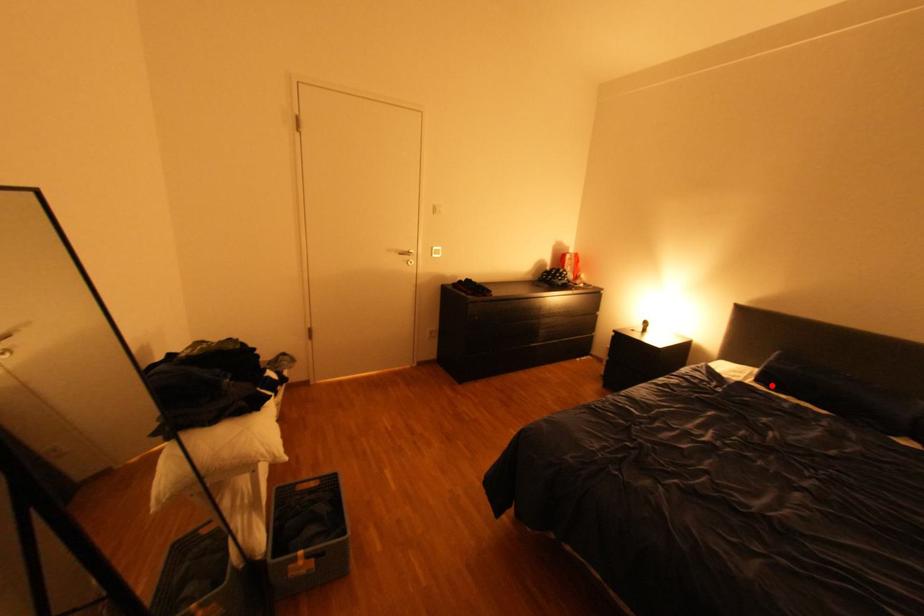
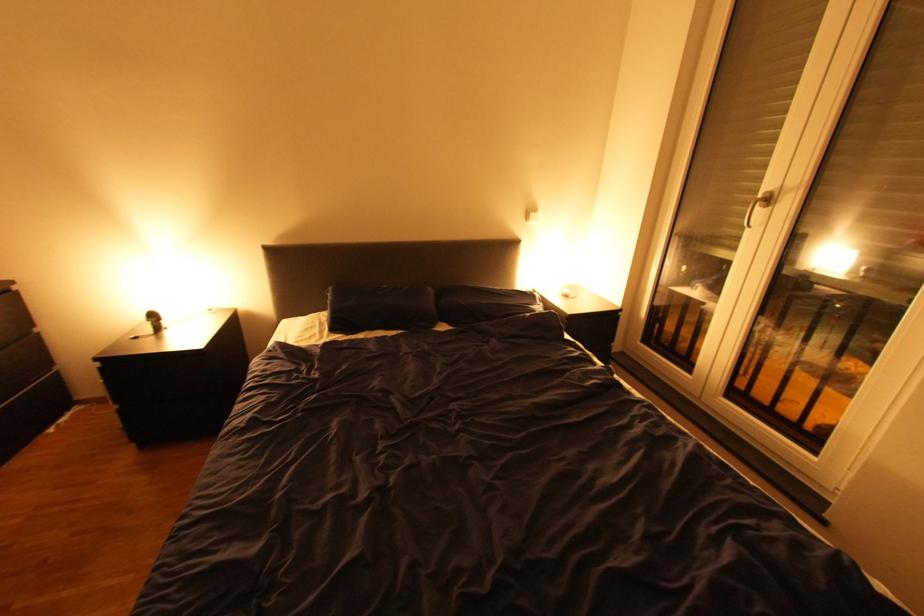
Find the pixel in the second image that matches the highlighted location in the first image.

(348, 333)